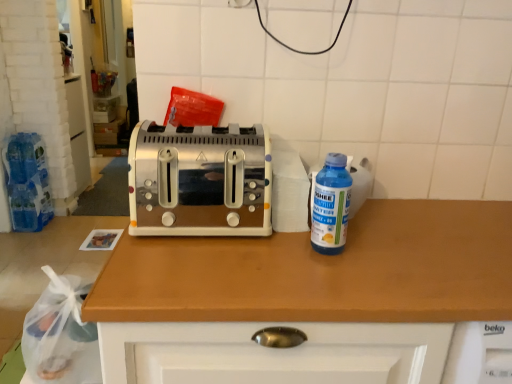
The width and height of the screenshot is (512, 384). I want to click on free space in front of blue plastic bottle at right, so click(x=329, y=283).